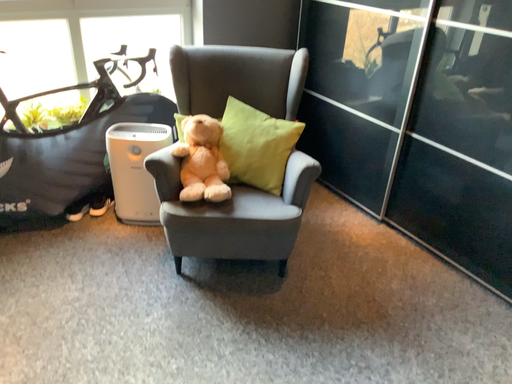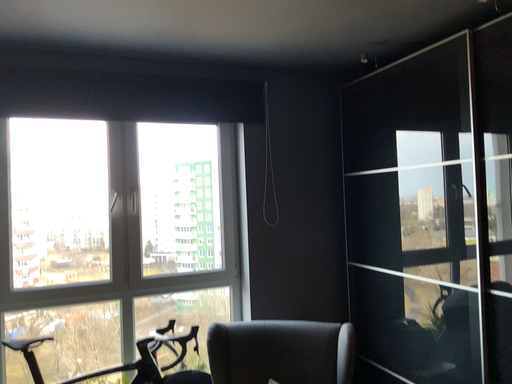
Question: How did the camera likely rotate when shooting the video?

Choices:
 (A) rotated left
 (B) rotated right

Answer: (A)